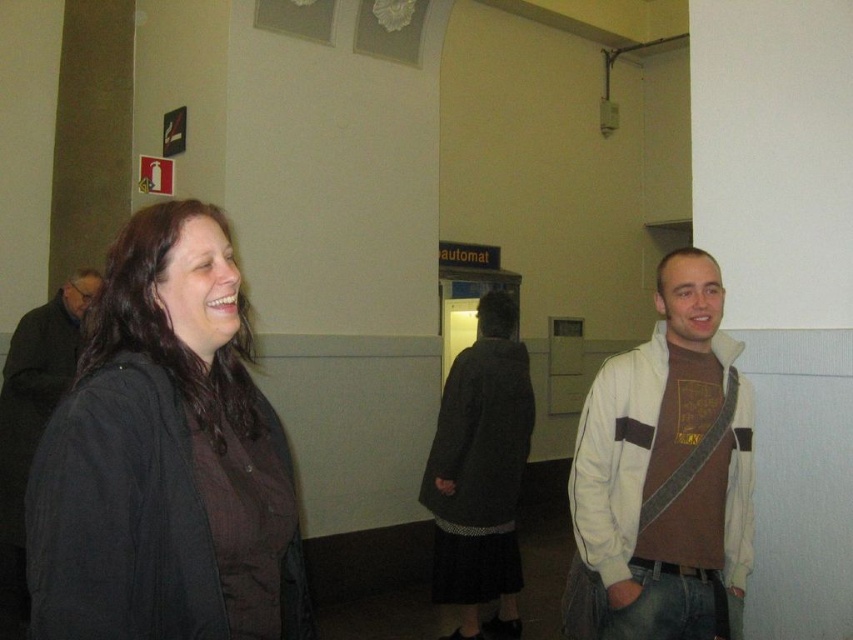
You are standing at point (68,285) and want to walk to point (303,627). Is the destination point in front of or behind you?

The destination point (303,627) is in front of you because it is in front of point (68,285) where you are standing.